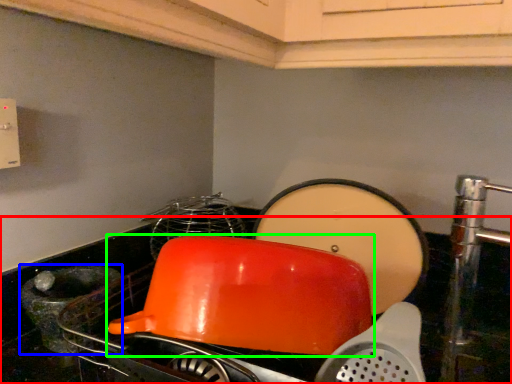
Question: Which object is positioned farthest from counter top (highlighted by a red box)? Select from appliance (highlighted by a blue box) and kitchen appliance (highlighted by a green box).

Choices:
 (A) appliance
 (B) kitchen appliance

Answer: (B)